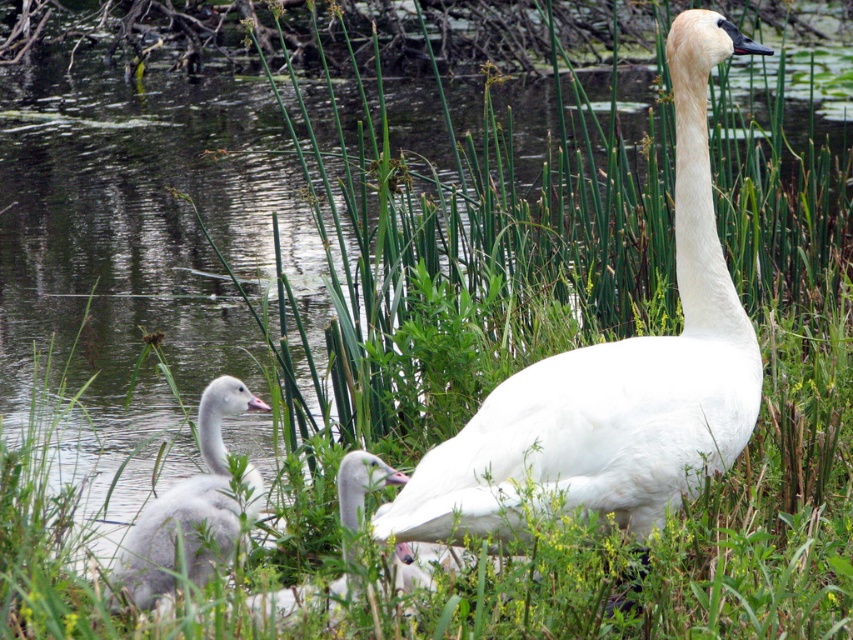
Question: Which of the following is the closest to the observer?

Choices:
 (A) (508, 451)
 (B) (358, 506)

Answer: (A)

Question: Is white feathered swan at center above gray downy swan at lower left?

Choices:
 (A) no
 (B) yes

Answer: (B)

Question: Does gray downy swan at lower left have a larger size compared to white matte duckling at center?

Choices:
 (A) no
 (B) yes

Answer: (B)

Question: Which point is closer to the camera?

Choices:
 (A) gray downy swan at lower left
 (B) white feathered swan at center

Answer: (B)

Question: Among these points, which one is farthest from the camera?

Choices:
 (A) (415, 577)
 (B) (737, 428)

Answer: (B)

Question: Does white feathered swan at center have a larger size compared to white matte duckling at center?

Choices:
 (A) yes
 (B) no

Answer: (A)